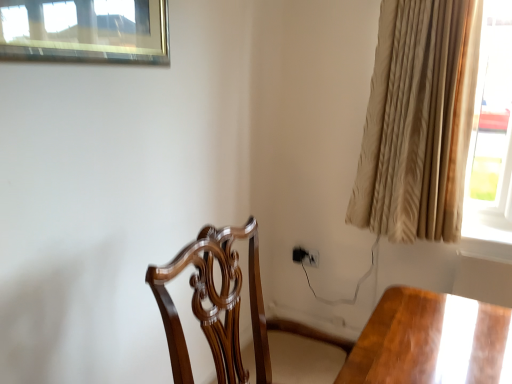
Measure the distance between polished wood chair at center and camera.

polished wood chair at center is 3.39 feet from camera.

Describe the element at coordinates (238, 318) in the screenshot. I see `polished wood chair at center` at that location.

Find the location of a particular element. The image size is (512, 384). polished wood chair at center is located at coordinates (238, 318).

Identify the location of beige textured curtain at right. (418, 120).

What is the approximate width of beige textured curtain at right?

beige textured curtain at right is 10.34 inches wide.

Image resolution: width=512 pixels, height=384 pixels. What do you see at coordinates (418, 120) in the screenshot?
I see `beige textured curtain at right` at bounding box center [418, 120].

You are a GUI agent. You are given a task and a screenshot of the screen. Output one action in this format:
    pyautogui.click(x=<x>, y=<y>)
    Task: Click on the polished wood chair at center
    The image size is (512, 384).
    Given the screenshot: What is the action you would take?
    pyautogui.click(x=238, y=318)

Which object is positioned more to the left, beige textured curtain at right or polished wood chair at center?

polished wood chair at center.

Which object is closer to the camera, beige textured curtain at right or polished wood chair at center?

polished wood chair at center is more forward.

Between point (401, 229) and point (265, 340), which one is positioned behind?

The point (401, 229) is farther from the camera.

From the image's perspective, is beige textured curtain at right above or below polished wood chair at center?

beige textured curtain at right is situated higher than polished wood chair at center in the image.

From a real-world perspective, is beige textured curtain at right on polished wood chair at center?

Correct, in the physical world, beige textured curtain at right is higher than polished wood chair at center.

Is beige textured curtain at right wider than polished wood chair at center?

Incorrect, the width of beige textured curtain at right does not surpass that of polished wood chair at center.

Between beige textured curtain at right and polished wood chair at center, which one has more height?

beige textured curtain at right.

Does beige textured curtain at right have a larger size compared to polished wood chair at center?

Incorrect, beige textured curtain at right is not larger than polished wood chair at center.

Is beige textured curtain at right not inside polished wood chair at center?

Yes, beige textured curtain at right is located beyond the bounds of polished wood chair at center.

Can you see beige textured curtain at right touching polished wood chair at center?

They are not placed beside each other.

Could you tell me if beige textured curtain at right is turned towards polished wood chair at center?

Yes, beige textured curtain at right is aimed at polished wood chair at center.

This screenshot has width=512, height=384. I want to click on curtain above the polished wood chair at center (from the image's perspective), so click(418, 120).

Which object is positioned more to the right, polished wood chair at center or beige textured curtain at right?

beige textured curtain at right is more to the right.

Is the position of polished wood chair at center more distant than that of beige textured curtain at right?

That is False.

Which point is more forward, (208, 315) or (414, 104)?

The point (208, 315) is more forward.

Consider the image. From the image's perspective, would you say polished wood chair at center is shown under beige textured curtain at right?

Yes, from the image's perspective, polished wood chair at center is beneath beige textured curtain at right.

From a real-world perspective, is polished wood chair at center located higher than beige textured curtain at right?

Actually, polished wood chair at center is physically below beige textured curtain at right in the real world.

Considering the sizes of objects polished wood chair at center and beige textured curtain at right in the image provided, who is thinner, polished wood chair at center or beige textured curtain at right?

beige textured curtain at right.

Considering the relative sizes of polished wood chair at center and beige textured curtain at right in the image provided, is polished wood chair at center taller than beige textured curtain at right?

In fact, polished wood chair at center may be shorter than beige textured curtain at right.

Between polished wood chair at center and beige textured curtain at right, which one has larger size?

Bigger between the two is polished wood chair at center.

In the scene shown: Is polished wood chair at center outside of beige textured curtain at right?

Yes, polished wood chair at center is located beyond the bounds of beige textured curtain at right.

Is polished wood chair at center directly adjacent to beige textured curtain at right?

No.

Is beige textured curtain at right at the back of polished wood chair at center?

No, polished wood chair at center is not facing away from beige textured curtain at right.

Can you tell me how much polished wood chair at center and beige textured curtain at right differ in facing direction?

The facing directions of polished wood chair at center and beige textured curtain at right are 86.2 degrees apart.

Identify the location of chair in front of the beige textured curtain at right. The height and width of the screenshot is (384, 512). (238, 318).

Identify the location of curtain above the polished wood chair at center (from the image's perspective). (418, 120).

The height and width of the screenshot is (384, 512). I want to click on curtain that appears behind the polished wood chair at center, so click(418, 120).